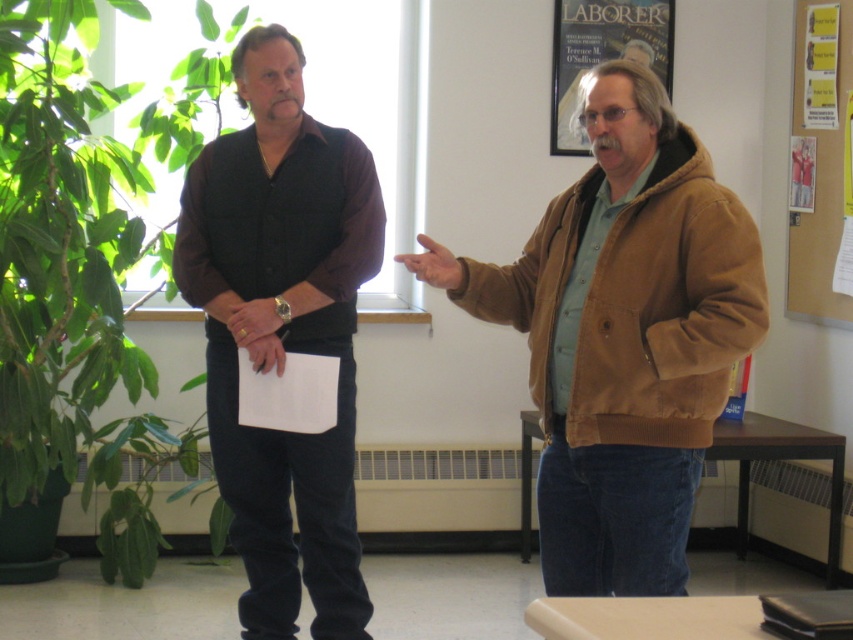
You are a photographer setting up for a group photo. You see the black matte vest at left and the corkboard at right in the frame. Which object is closer to the left edge of the photo?

The black matte vest at left is positioned on the left side of the corkboard at right, so it is closer to the left edge of the photo.

You are an interior designer assessing the spatial compatibility of two items in a room. You see the brown suede jacket at right and the black matte vest at left. Which item has a shorter length?

The brown suede jacket at right is shorter than the black matte vest at left.